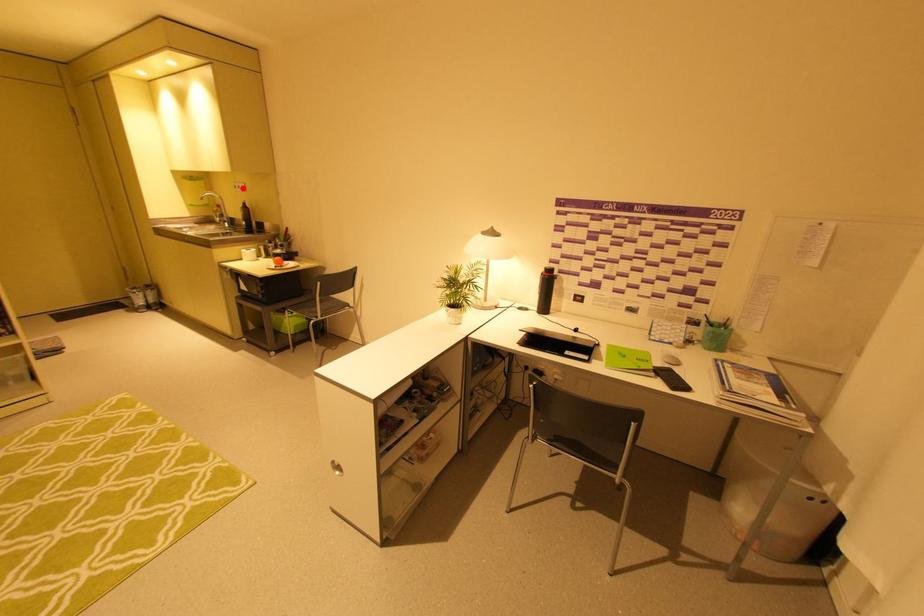
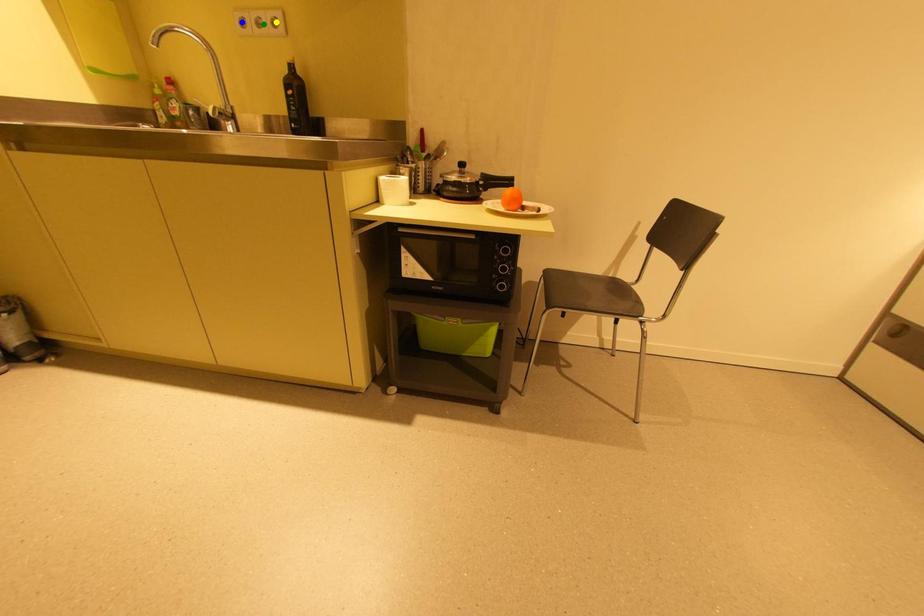
Question: I am providing you with two images of the same scene from different viewpoints. A red point is marked on the first image. You are given multiple points on the second image. Which spot in image 2 lines up with the point in image 1?

Choices:
 (A) blue point
 (B) yellow point
 (C) green point

Answer: (C)